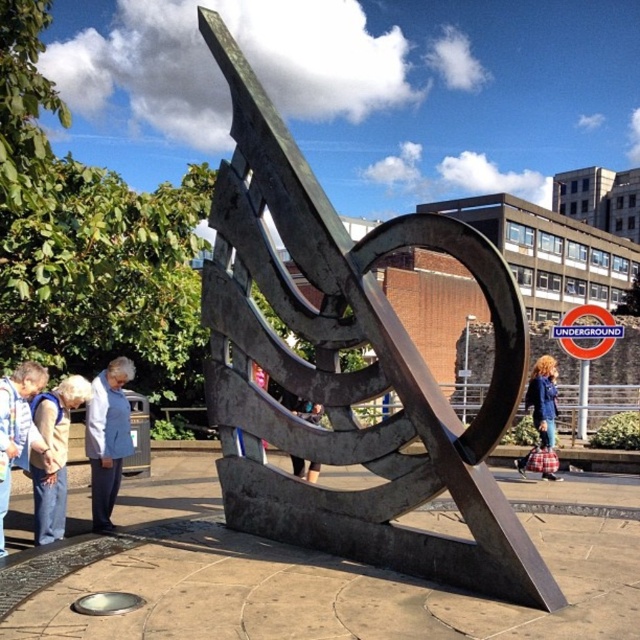
Which is above, light blue fabric jacket at lower left or light beige fabric at lower left?

light blue fabric jacket at lower left is above.

Which of these two, light blue fabric jacket at lower left or light beige fabric at lower left, stands taller?

With more height is light blue fabric jacket at lower left.

Locate an element on the screen. The image size is (640, 640). light blue fabric jacket at lower left is located at coordinates (108, 436).

Identify the location of light blue fabric jacket at lower left. This screenshot has width=640, height=640. (108, 436).

Does polished bronze sculpture at center have a smaller size compared to light beige fabric at lower left?

No.

Is polished bronze sculpture at center wider than light beige fabric at lower left?

Indeed, polished bronze sculpture at center has a greater width compared to light beige fabric at lower left.

Is point (230, 312) positioned before point (45, 442)?

No, (230, 312) is behind (45, 442).

Locate an element on the screen. The width and height of the screenshot is (640, 640). polished bronze sculpture at center is located at coordinates (349, 371).

Does light beige fabric at lower left appear under blue denim jacket at center?

Yes, light beige fabric at lower left is below blue denim jacket at center.

Is point (54, 465) positioned before point (548, 369)?

That is True.

Where is `light beige fabric at lower left`? This screenshot has width=640, height=640. light beige fabric at lower left is located at coordinates (52, 456).